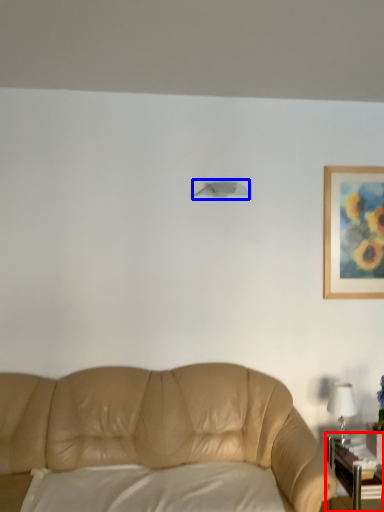
Question: Which of the following is the farthest to the observer, table (highlighted by a red box) or lamp (highlighted by a blue box)?

Choices:
 (A) table
 (B) lamp

Answer: (B)